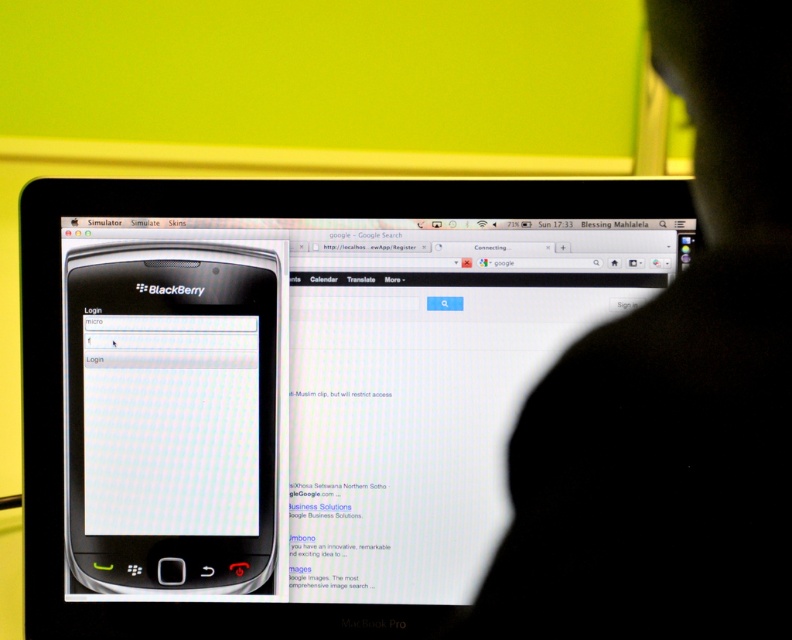
Consider the image. You are a photographer trying to focus on two points on a MacBook Pro screen. The points are labeled as point 1 at coordinates (699, 120) and point 2 at coordinates (195, 492). Which point is closer to your camera lens?

Point 1 at coordinates (699, 120) is closer to the camera lens than point 2 at coordinates (195, 492).